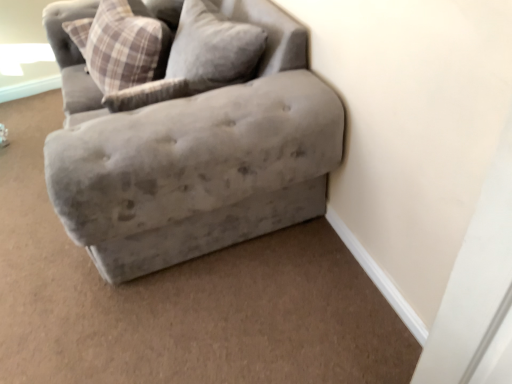
Question: Is velvet gray couch at upper right inside or outside of plaid fabric pillow at upper left?

Choices:
 (A) outside
 (B) inside

Answer: (A)

Question: In terms of height, does velvet gray couch at upper right look taller or shorter compared to plaid fabric pillow at upper left?

Choices:
 (A) tall
 (B) short

Answer: (A)

Question: From the image's perspective, is velvet gray couch at upper right located above or below plaid fabric pillow at upper left?

Choices:
 (A) above
 (B) below

Answer: (B)

Question: Relative to velvet gray couch at upper right, is plaid fabric pillow at upper left in front or behind?

Choices:
 (A) behind
 (B) front

Answer: (A)

Question: From a real-world perspective, is plaid fabric pillow at upper left positioned above or below velvet gray couch at upper right?

Choices:
 (A) above
 (B) below

Answer: (A)

Question: In terms of height, does plaid fabric pillow at upper left look taller or shorter compared to velvet gray couch at upper right?

Choices:
 (A) tall
 (B) short

Answer: (B)

Question: Visually, is plaid fabric pillow at upper left positioned to the left or to the right of velvet gray couch at upper right?

Choices:
 (A) left
 (B) right

Answer: (A)